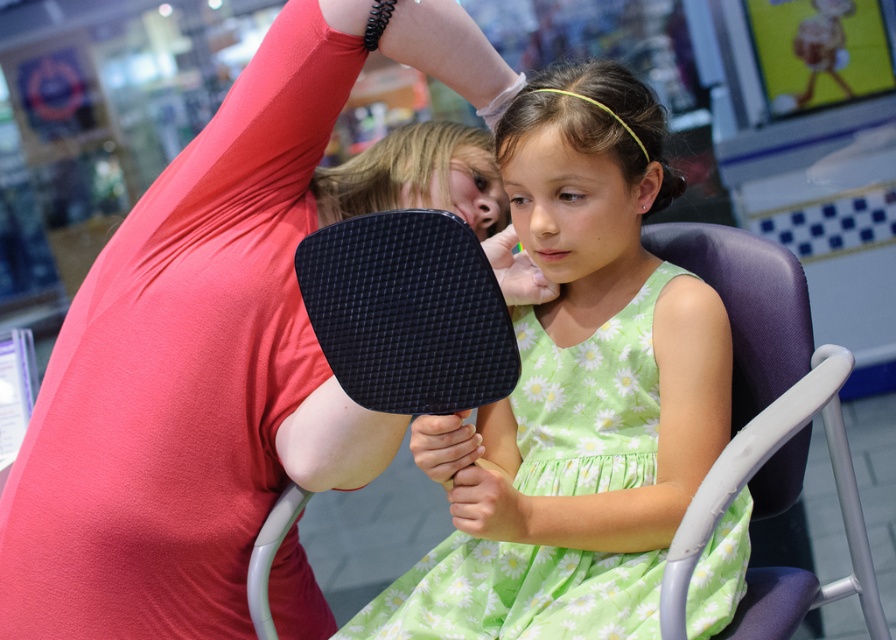
Looking at this image, you are a fashion designer observing two dresses displayed at the center of a store. The dresses are labeled as the matte pink dress at center and the green floral fabric dress at center. Which dress is taller in height?

The matte pink dress at center is much taller than the green floral fabric dress at center.

You are a fashion designer observing two dresses displayed in a mall. The matte pink dress at center and the green floral fabric dress at center are part of your new collection. You need to place them on a mannequin stand that can only accommodate items within 12 inches of each other. Will both dresses fit on the stand?

The matte pink dress at center and green floral fabric dress at center are 13.62 inches apart, which exceeds the 12 inches requirement. Therefore, they cannot both fit on the mannequin stand.

You are a fashion designer observing two dresses displayed in the center of a public space. The dresses are labeled as the matte pink dress at center and the green floral fabric dress at center. Based on their appearance, which dress do you think has a larger width?

The matte pink dress at center might be wider than green floral fabric dress at center, so the matte pink dress at center likely has a larger width.